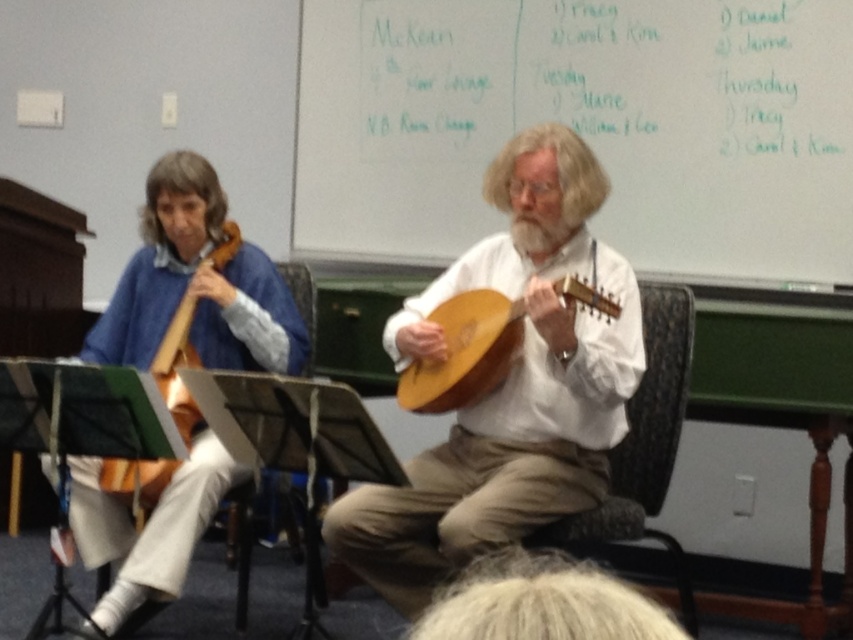
Question: Which of the following is the closest to the observer?

Choices:
 (A) (570, 154)
 (B) (691, 348)
 (C) (508, 317)
 (D) (187, 394)

Answer: (C)

Question: Does whiteboard at upper center have a larger size compared to wooden acoustic guitar at center?

Choices:
 (A) no
 (B) yes

Answer: (B)

Question: Considering the relative positions of whiteboard at upper center and wooden mandolin at center in the image provided, where is whiteboard at upper center located with respect to wooden mandolin at center?

Choices:
 (A) below
 (B) above

Answer: (B)

Question: Which point is closer to the camera?

Choices:
 (A) (624, 148)
 (B) (525, 218)

Answer: (B)

Question: Can you confirm if wooden mandolin at center is positioned to the left of white matte beard at center?

Choices:
 (A) yes
 (B) no

Answer: (A)

Question: Which object appears farthest from the camera in this image?

Choices:
 (A) wooden acoustic guitar at center
 (B) white matte beard at center
 (C) wooden at left

Answer: (C)